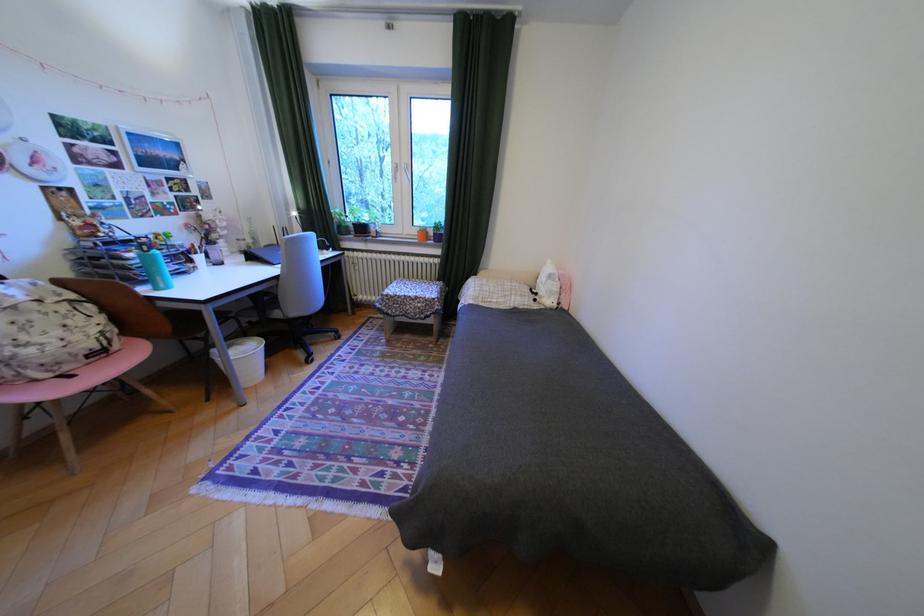
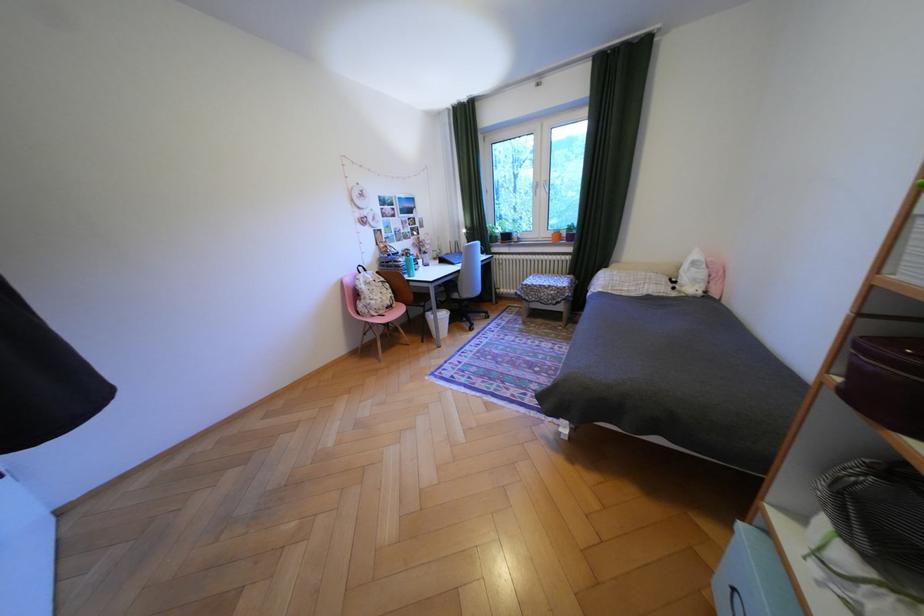
Find the pixel in the second image that matches point 79,368 in the first image.

(393, 312)